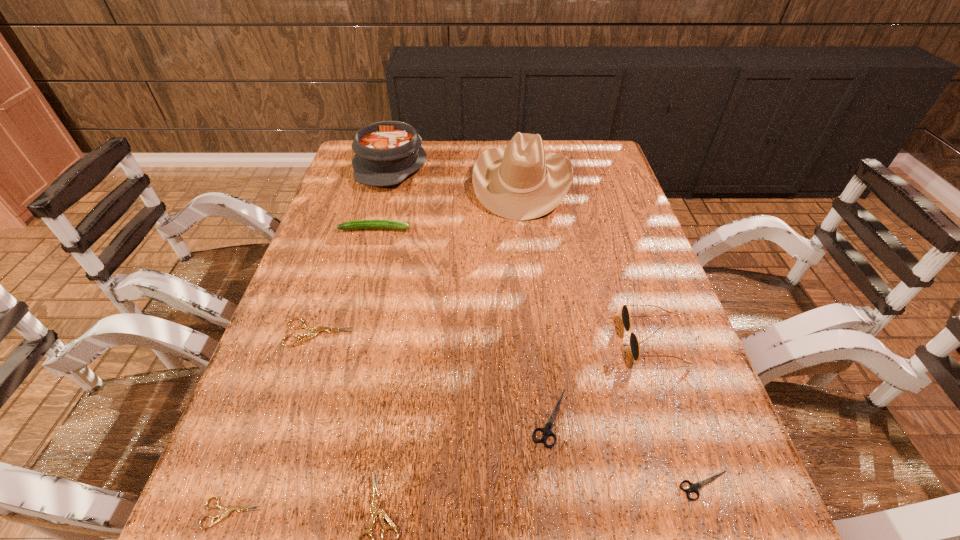
You are a GUI agent. You are given a task and a screenshot of the screen. Output one action in this format:
    pyautogui.click(x=<x>, y=<y>)
    Task: Click on the free space at the far left corner of the desktop
    The image size is (960, 540).
    Given the screenshot: What is the action you would take?
    pyautogui.click(x=351, y=146)

Where is `vacant space at the far right corner of the desktop`? This screenshot has width=960, height=540. vacant space at the far right corner of the desktop is located at coordinates (588, 148).

The width and height of the screenshot is (960, 540). I want to click on unoccupied position between the smallest beige shears and the farthest beige shears, so click(276, 423).

Where is `unoccupied area between the eighth shortest object and the farthest beige shears`? unoccupied area between the eighth shortest object and the farthest beige shears is located at coordinates (355, 249).

I want to click on vacant space that's between the shortest shears and the farthest shears, so click(276, 423).

Where is `free space between the biggest beige shears and the smallest beige shears`? free space between the biggest beige shears and the smallest beige shears is located at coordinates (276, 423).

Find the location of a particular element. vacant space that is in between the shortest shears and the third tallest object is located at coordinates (442, 426).

The width and height of the screenshot is (960, 540). I want to click on vacant space that's between the seventh nearest object and the black sunglasses, so click(514, 284).

Select which object appears as the fourth closest to the second tallest object. Please provide its 2D coordinates. Your answer should be formatted as a tuple, i.e. [(x, y)], where the tuple contains the x and y coordinates of a point satisfying the conditions above.

[(634, 344)]

Choose which object is the nearest neighbor to the second tallest object. Please provide its 2D coordinates. Your answer should be formatted as a tuple, i.e. [(x, y)], where the tuple contains the x and y coordinates of a point satisfying the conditions above.

[(521, 182)]